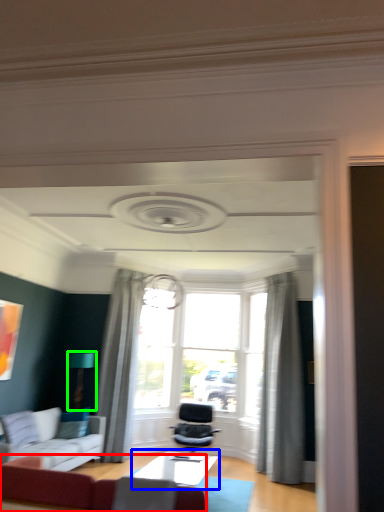
Question: Considering the real-world distances, which object is farthest from studio couch (highlighted by a red box)? table (highlighted by a blue box) or light fixture (highlighted by a green box)?

Choices:
 (A) table
 (B) light fixture

Answer: (B)